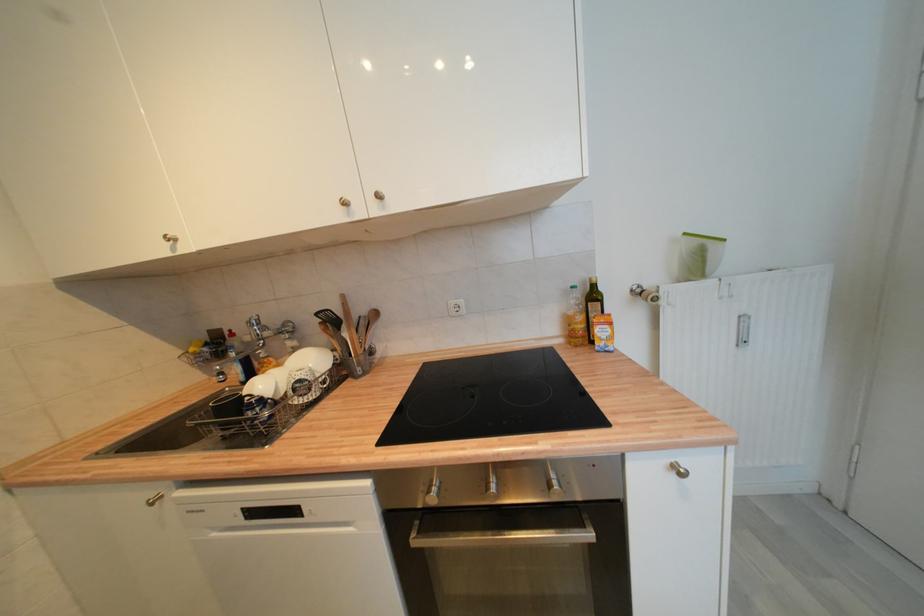
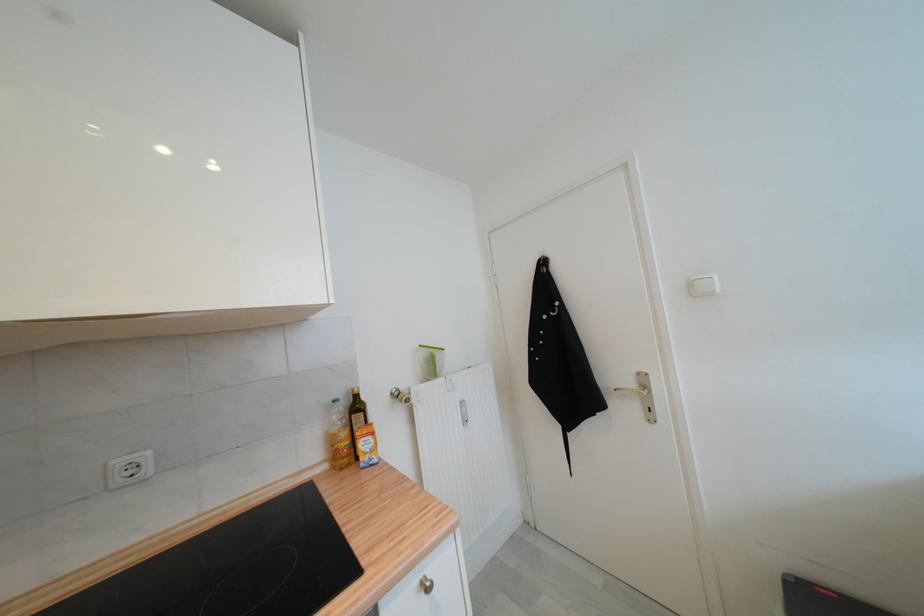
Find the pixel in the second image that matches point (578, 289) in the first image.

(339, 403)